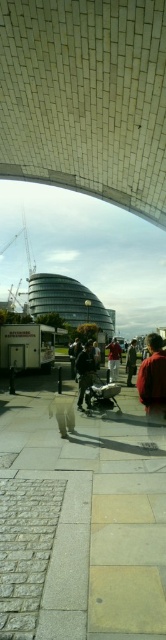
Who is higher up, dark gray fabric jacket at center or dark brown leather jacket at center?

dark gray fabric jacket at center

Who is more forward, (84, 388) or (129, 344)?

Point (84, 388)

Is point (79, 378) positioned before point (132, 353)?

Yes, point (79, 378) is in front of point (132, 353).

Where is `dark gray fabric jacket at center`? dark gray fabric jacket at center is located at coordinates (84, 369).

Does dark gray fabric jacket at center have a lesser width compared to red fabric jacket at center?

Yes, dark gray fabric jacket at center is thinner than red fabric jacket at center.

Consider the image. Is dark gray fabric jacket at center to the left of red fabric jacket at center from the viewer's perspective?

Yes, dark gray fabric jacket at center is to the left of red fabric jacket at center.

Which is in front, point (81, 403) or point (109, 380)?

Point (81, 403) is in front.

Locate an element on the screen. The width and height of the screenshot is (166, 640). dark gray fabric jacket at center is located at coordinates (84, 369).

Who is more forward, (116, 353) or (129, 362)?

Positioned in front is point (116, 353).

Which of these two, red fabric jacket at center or dark brown leather jacket at center, stands taller?

With more height is red fabric jacket at center.

Where is `red fabric jacket at center`? red fabric jacket at center is located at coordinates (114, 358).